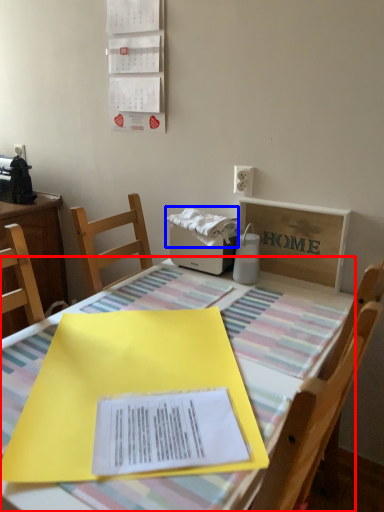
Question: Which object appears farthest to the camera in this image, table (highlighted by a red box) or fabric (highlighted by a blue box)?

Choices:
 (A) table
 (B) fabric

Answer: (B)